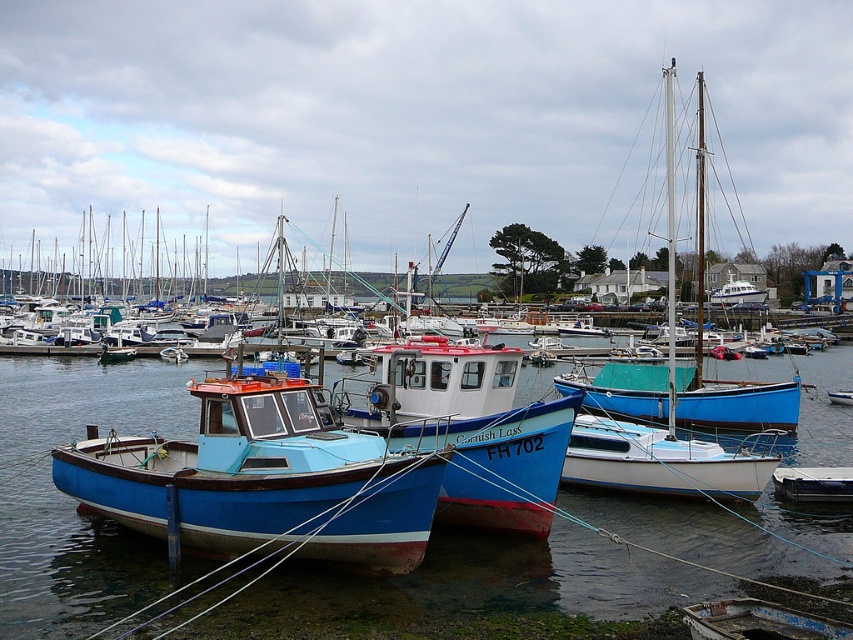
Can you confirm if blue matte water at center is taller than teal wooden sailboat at center?

Incorrect, blue matte water at center's height is not larger of teal wooden sailboat at center's.

Does blue matte water at center have a larger size compared to teal wooden sailboat at center?

Incorrect, blue matte water at center is not larger than teal wooden sailboat at center.

Who is more distant from viewer, (x=306, y=612) or (x=666, y=356)?

Positioned behind is point (x=666, y=356).

Identify the location of blue matte water at center. Image resolution: width=853 pixels, height=640 pixels. (71, 499).

Measure the distance from matte blue boat at center to teal wooden sailboat at center.

The distance of matte blue boat at center from teal wooden sailboat at center is 17.22 meters.

Consider the image. Which is more to the left, matte blue boat at center or teal wooden sailboat at center?

From the viewer's perspective, matte blue boat at center appears more on the left side.

Who is more forward, (190, 452) or (700, 156)?

Point (190, 452) is more forward.

This screenshot has height=640, width=853. Find the location of `matte blue boat at center`. matte blue boat at center is located at coordinates (260, 481).

Which is above, blue matte water at center or matte blue boat at center?

matte blue boat at center

Does blue matte water at center appear over matte blue boat at center?

No.

This screenshot has width=853, height=640. Identify the location of blue matte water at center. (71, 499).